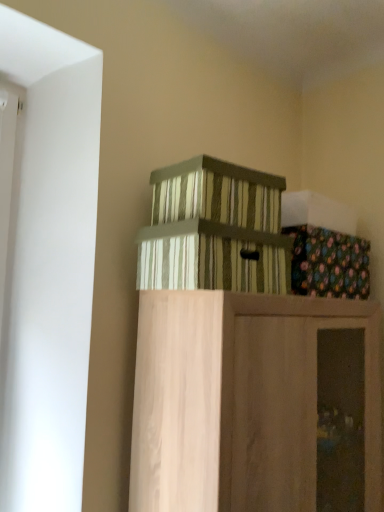
The image size is (384, 512). What do you see at coordinates (317, 212) in the screenshot?
I see `floral fabric box at upper right` at bounding box center [317, 212].

At what (x,y) coordinates should I click in order to perform the action: click on floral fabric box at upper right. Please return your answer as a coordinate pair (x, y). The width and height of the screenshot is (384, 512). Looking at the image, I should click on (317, 212).

Describe the element at coordinates (214, 230) in the screenshot. This screenshot has width=384, height=512. I see `striped cardboard box at center, which is the 2th crate from top to bottom` at that location.

You are a GUI agent. You are given a task and a screenshot of the screen. Output one action in this format:
    pyautogui.click(x=<x>, y=<y>)
    Task: Click on the striped cardboard crate at upper center, positioned as the 1th crate in top-to-bottom order
    Image resolution: width=384 pixels, height=512 pixels.
    Given the screenshot: What is the action you would take?
    pyautogui.click(x=216, y=194)

Could you tell me if striped cardboard crate at upper center, positioned as the 1th crate in top-to-bottom order, is turned towards striped cardboard box at center, which is the 2th crate from top to bottom?

No, striped cardboard crate at upper center, positioned as the 1th crate in top-to-bottom order, is not aimed at striped cardboard box at center, which is the 2th crate from top to bottom.

Can you confirm if striped cardboard crate at upper center, arranged as the 2th crate when ordered from the bottom, is positioned to the left of striped cardboard box at center, which is the 2th crate from top to bottom?

In fact, striped cardboard crate at upper center, arranged as the 2th crate when ordered from the bottom, is to the right of striped cardboard box at center, which is the 2th crate from top to bottom.

Is striped cardboard box at center, placed as the first crate when sorted from bottom to top, a part of striped cardboard crate at upper center, arranged as the 2th crate when ordered from the bottom?

Definitely not — striped cardboard box at center, placed as the first crate when sorted from bottom to top, is not inside striped cardboard crate at upper center, arranged as the 2th crate when ordered from the bottom.

Who is taller, striped cardboard crate at upper center, arranged as the 2th crate when ordered from the bottom, or striped cardboard box at center, which is the 2th crate from top to bottom?

With more height is striped cardboard box at center, which is the 2th crate from top to bottom.

From the image's perspective, is wooden cabinet at upper center above striped cardboard crate at upper center, arranged as the 2th crate when ordered from the bottom?

No, from the image's perspective, wooden cabinet at upper center is not on top of striped cardboard crate at upper center, arranged as the 2th crate when ordered from the bottom.

Which is closer to the camera, (223, 362) or (277, 201)?

The point (223, 362) is closer to the camera.

Between wooden cabinet at upper center and striped cardboard crate at upper center, positioned as the 1th crate in top-to-bottom order, which one has smaller size?

Smaller between the two is striped cardboard crate at upper center, positioned as the 1th crate in top-to-bottom order.

Is wooden cabinet at upper center with striped cardboard crate at upper center, arranged as the 2th crate when ordered from the bottom?

No.

Does wooden cabinet at upper center lie in front of striped cardboard box at center, placed as the first crate when sorted from bottom to top?

Yes, it is in front of striped cardboard box at center, placed as the first crate when sorted from bottom to top.

Does wooden cabinet at upper center have a lesser height compared to striped cardboard box at center, placed as the first crate when sorted from bottom to top?

No.

Considering the sizes of objects wooden cabinet at upper center and striped cardboard box at center, placed as the first crate when sorted from bottom to top, in the image provided, who is thinner, wooden cabinet at upper center or striped cardboard box at center, placed as the first crate when sorted from bottom to top,?

striped cardboard box at center, placed as the first crate when sorted from bottom to top.

Is striped cardboard box at center, placed as the first crate when sorted from bottom to top, at the back of wooden cabinet at upper center?

No, wooden cabinet at upper center is not facing the opposite direction of striped cardboard box at center, placed as the first crate when sorted from bottom to top.

From the picture: From a real-world perspective, is striped cardboard box at center, placed as the first crate when sorted from bottom to top, physically located above or below floral fabric box at upper right?

striped cardboard box at center, placed as the first crate when sorted from bottom to top, is situated lower than floral fabric box at upper right in the real world.

Is striped cardboard box at center, which is the 2th crate from top to bottom, outside of floral fabric box at upper right?

Yes, striped cardboard box at center, which is the 2th crate from top to bottom, is located beyond the bounds of floral fabric box at upper right.

Is striped cardboard box at center, placed as the first crate when sorted from bottom to top, bigger than floral fabric box at upper right?

Yes.

Which is behind, point (140, 274) or point (322, 225)?

Positioned behind is point (322, 225).

From the picture: Is striped cardboard box at center, placed as the first crate when sorted from bottom to top, oriented towards striped cardboard crate at upper center, arranged as the 2th crate when ordered from the bottom?

No, striped cardboard box at center, placed as the first crate when sorted from bottom to top, is not aimed at striped cardboard crate at upper center, arranged as the 2th crate when ordered from the bottom.

Locate an element on the screen. crate beneath the striped cardboard crate at upper center, positioned as the 1th crate in top-to-bottom order (from a real-world perspective) is located at coordinates click(x=214, y=230).

Can striped cardboard crate at upper center, positioned as the 1th crate in top-to-bottom order, be found inside striped cardboard box at center, placed as the first crate when sorted from bottom to top?

A: No, striped cardboard box at center, placed as the first crate when sorted from bottom to top, does not contain striped cardboard crate at upper center, positioned as the 1th crate in top-to-bottom order.

Can you confirm if striped cardboard box at center, which is the 2th crate from top to bottom, is bigger than striped cardboard crate at upper center, positioned as the 1th crate in top-to-bottom order?

Yes.

The image size is (384, 512). Identify the location of box on the right side of striped cardboard crate at upper center, arranged as the 2th crate when ordered from the bottom. (317, 212).

Can striped cardboard crate at upper center, positioned as the 1th crate in top-to-bottom order, be found inside floral fabric box at upper right?

No, floral fabric box at upper right does not contain striped cardboard crate at upper center, positioned as the 1th crate in top-to-bottom order.

Is floral fabric box at upper right smaller than striped cardboard crate at upper center, arranged as the 2th crate when ordered from the bottom?

Yes.

In order to click on the 2nd crate positioned above the wooden cabinet at upper center (from the image's perspective) in this screenshot , I will do `click(216, 194)`.

Is striped cardboard crate at upper center, positioned as the 1th crate in top-to-bottom order, far away from wooden cabinet at upper center?

striped cardboard crate at upper center, positioned as the 1th crate in top-to-bottom order, is near wooden cabinet at upper center, not far away.

Between striped cardboard crate at upper center, arranged as the 2th crate when ordered from the bottom, and wooden cabinet at upper center, which one has smaller size?

With smaller size is striped cardboard crate at upper center, arranged as the 2th crate when ordered from the bottom.

Considering the relative sizes of striped cardboard crate at upper center, positioned as the 1th crate in top-to-bottom order, and wooden cabinet at upper center in the image provided, is striped cardboard crate at upper center, positioned as the 1th crate in top-to-bottom order, wider than wooden cabinet at upper center?

No, striped cardboard crate at upper center, positioned as the 1th crate in top-to-bottom order, is not wider than wooden cabinet at upper center.

Where is `crate beneath the striped cardboard crate at upper center, arranged as the 2th crate when ordered from the bottom (from a real-world perspective)`? This screenshot has width=384, height=512. crate beneath the striped cardboard crate at upper center, arranged as the 2th crate when ordered from the bottom (from a real-world perspective) is located at coordinates (214, 230).

Locate an element on the screen. Image resolution: width=384 pixels, height=512 pixels. the 2nd crate behind the wooden cabinet at upper center, counting from the anchor's position is located at coordinates (216, 194).

Based on their spatial positions, is striped cardboard crate at upper center, arranged as the 2th crate when ordered from the bottom, or wooden cabinet at upper center closer to striped cardboard box at center, placed as the first crate when sorted from bottom to top?

striped cardboard crate at upper center, arranged as the 2th crate when ordered from the bottom, is closer to striped cardboard box at center, placed as the first crate when sorted from bottom to top.

Looking at the image, which one is located closer to striped cardboard crate at upper center, positioned as the 1th crate in top-to-bottom order, wooden cabinet at upper center or striped cardboard box at center, which is the 2th crate from top to bottom?

Based on the image, striped cardboard box at center, which is the 2th crate from top to bottom, appears to be nearer to striped cardboard crate at upper center, positioned as the 1th crate in top-to-bottom order.

Which object lies nearer to the anchor point striped cardboard box at center, placed as the first crate when sorted from bottom to top, striped cardboard crate at upper center, positioned as the 1th crate in top-to-bottom order, or floral fabric box at upper right?

striped cardboard crate at upper center, positioned as the 1th crate in top-to-bottom order, is closer to striped cardboard box at center, placed as the first crate when sorted from bottom to top.

Based on their spatial positions, is wooden cabinet at upper center or floral fabric box at upper right closer to striped cardboard crate at upper center, positioned as the 1th crate in top-to-bottom order?

floral fabric box at upper right.

Which object lies further to the anchor point striped cardboard box at center, placed as the first crate when sorted from bottom to top, wooden cabinet at upper center or striped cardboard crate at upper center, arranged as the 2th crate when ordered from the bottom?

Based on the image, wooden cabinet at upper center appears to be further to striped cardboard box at center, placed as the first crate when sorted from bottom to top.

Based on their spatial positions, is floral fabric box at upper right or striped cardboard box at center, which is the 2th crate from top to bottom, further from wooden cabinet at upper center?

floral fabric box at upper right.

From the image, which object appears to be farther from striped cardboard crate at upper center, positioned as the 1th crate in top-to-bottom order, floral fabric box at upper right or wooden cabinet at upper center?

wooden cabinet at upper center.

Considering their positions, is striped cardboard box at center, which is the 2th crate from top to bottom, positioned closer to wooden cabinet at upper center than floral fabric box at upper right?

striped cardboard box at center, which is the 2th crate from top to bottom, lies closer to wooden cabinet at upper center than the other object.

The height and width of the screenshot is (512, 384). I want to click on crate situated between striped cardboard box at center, placed as the first crate when sorted from bottom to top, and floral fabric box at upper right from left to right, so click(x=216, y=194).

Where is `box that lies between striped cardboard crate at upper center, positioned as the 1th crate in top-to-bottom order, and wooden cabinet at upper center from top to bottom`? The image size is (384, 512). box that lies between striped cardboard crate at upper center, positioned as the 1th crate in top-to-bottom order, and wooden cabinet at upper center from top to bottom is located at coordinates (317, 212).

Where is `crate between floral fabric box at upper right and wooden cabinet at upper center vertically`? crate between floral fabric box at upper right and wooden cabinet at upper center vertically is located at coordinates (214, 230).

Find the location of a particular element. The image size is (384, 512). crate between striped cardboard crate at upper center, positioned as the 1th crate in top-to-bottom order, and wooden cabinet at upper center vertically is located at coordinates (214, 230).